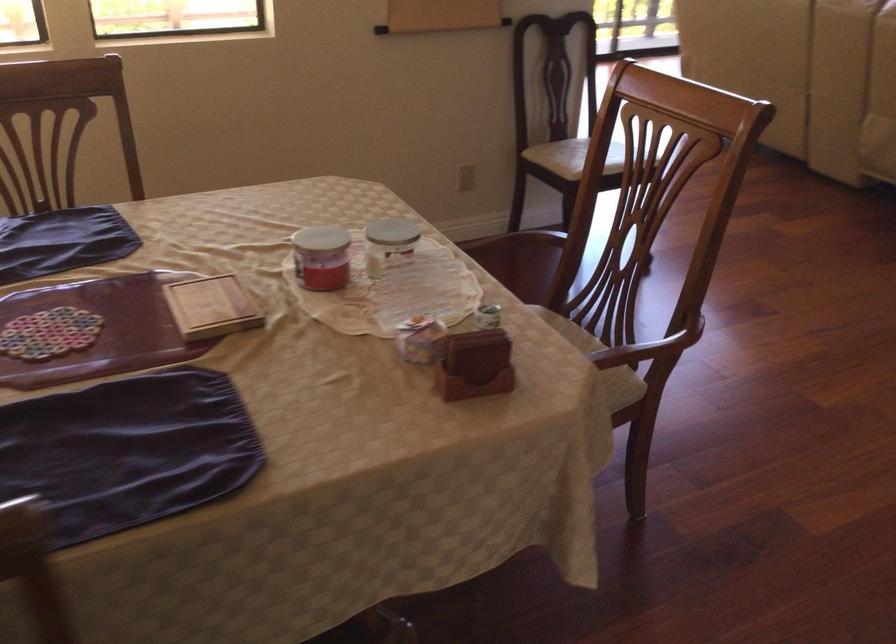
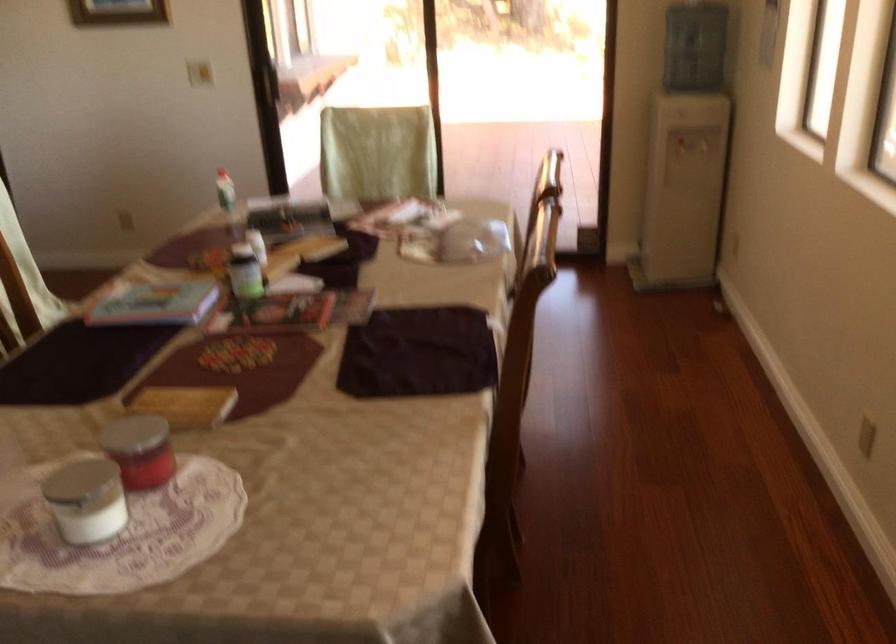
Where in the second image is the point corresponding to pixel 332 249 from the first image?

(149, 458)